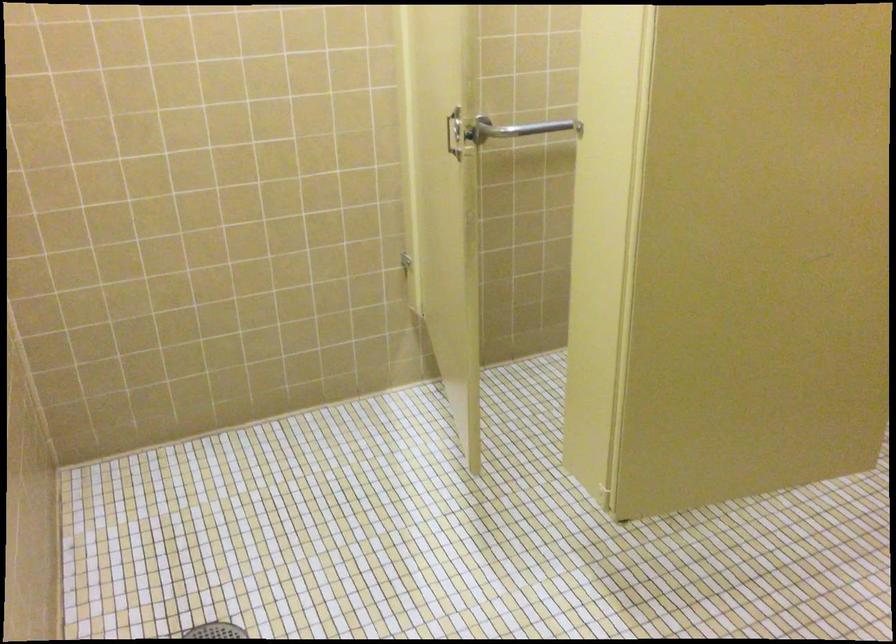
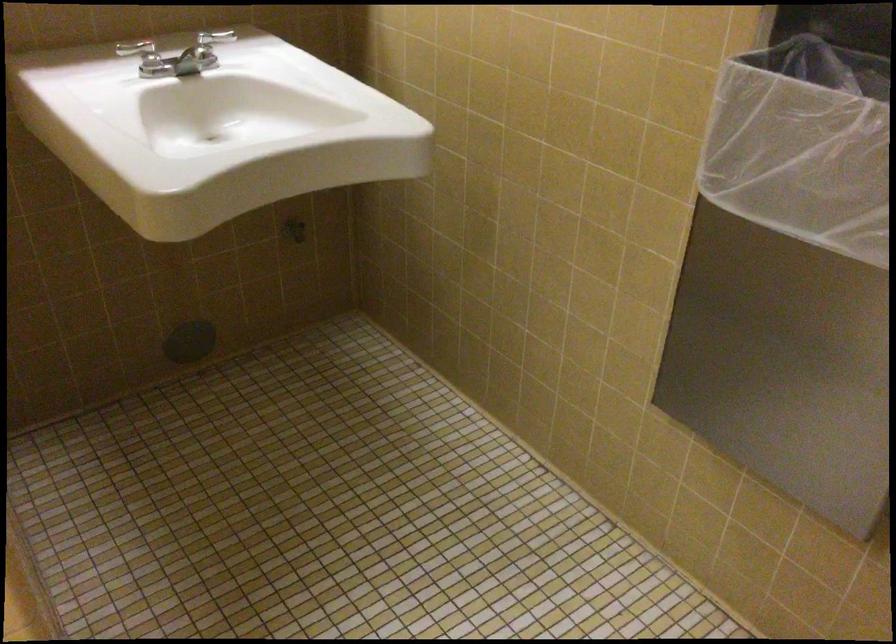
Based on the continuous images, in which direction is the camera rotating?

The camera rotated toward right-down.